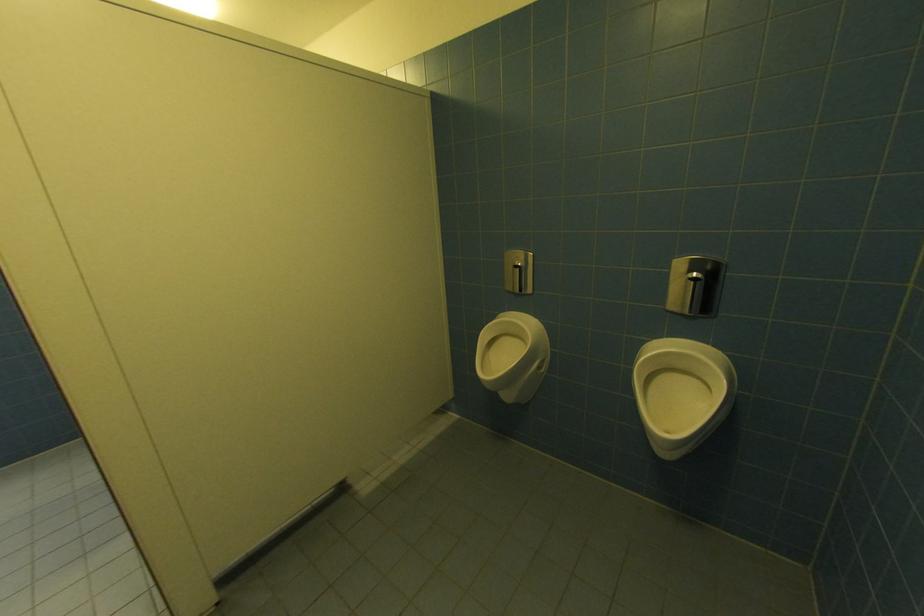
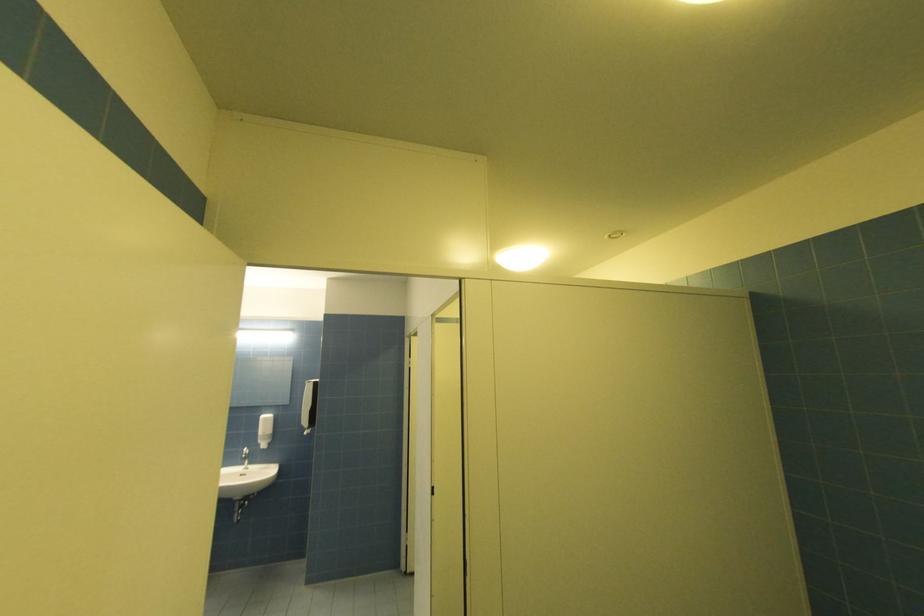
First-person continuous shooting, in which direction is the camera rotating?

The camera's rotation is toward left-up.